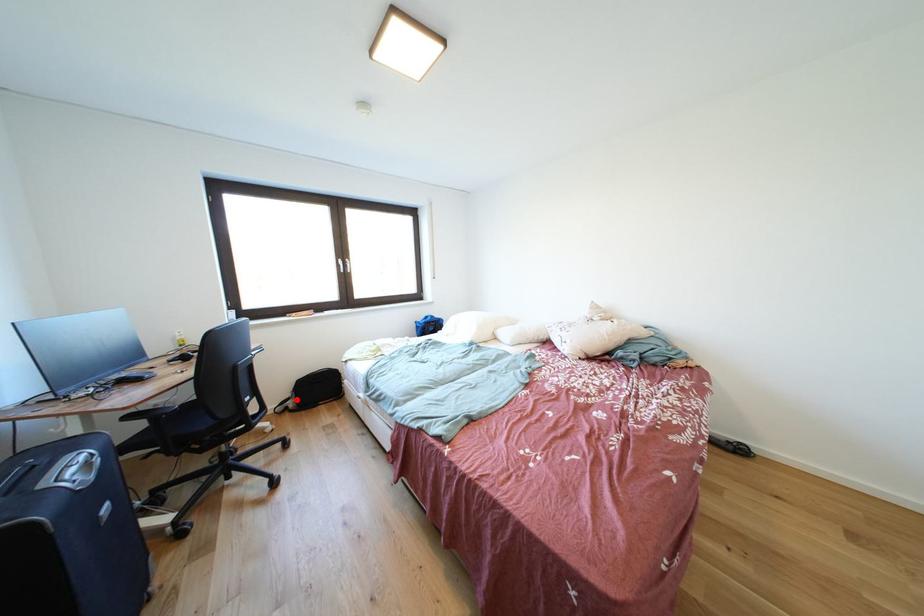
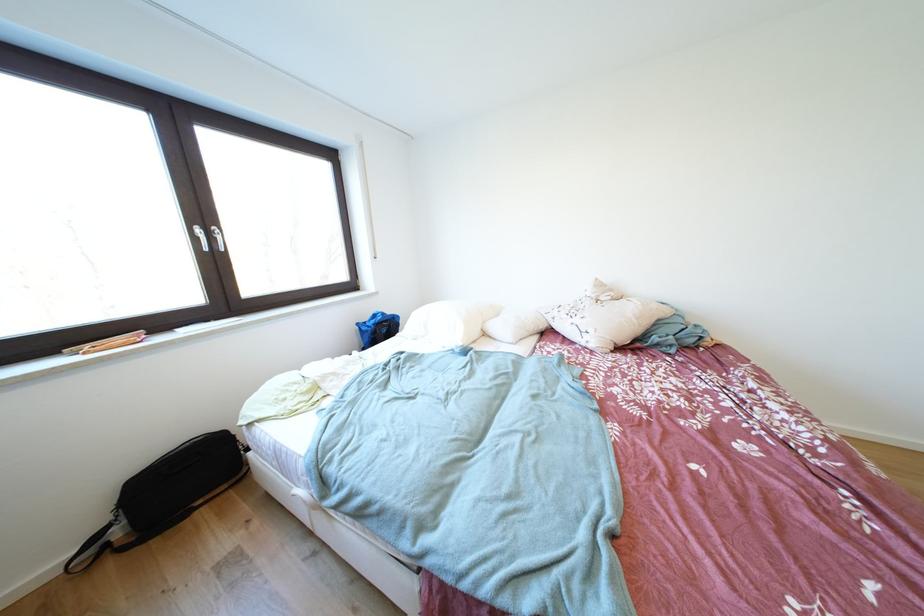
Question: I am providing you with two images of the same scene from different viewpoints. A red point is shown in image1. For the corresponding object point in image2, is it positioned nearer or farther from the camera?

Choices:
 (A) Nearer
 (B) Farther

Answer: (B)